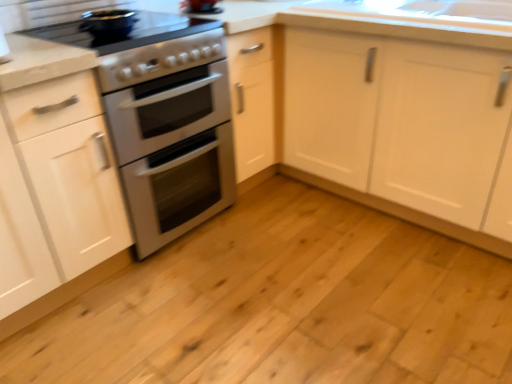
Question: Does white matte cabinet at left, placed as the 1th cabinetry when sorted from left to right, have a smaller size compared to matte black pot at upper left, which is counted as the 2th appliance, starting from the bottom?

Choices:
 (A) no
 (B) yes

Answer: (A)

Question: Is white matte cabinet at left, acting as the second cabinetry starting from the right, shorter than matte black pot at upper left, which is counted as the 2th appliance, starting from the bottom?

Choices:
 (A) no
 (B) yes

Answer: (A)

Question: Considering the relative positions of white matte cabinet at left, acting as the second cabinetry starting from the right, and matte black pot at upper left, which is counted as the 2th appliance, starting from the bottom, in the image provided, is white matte cabinet at left, acting as the second cabinetry starting from the right, to the right of matte black pot at upper left, which is counted as the 2th appliance, starting from the bottom, from the viewer's perspective?

Choices:
 (A) no
 (B) yes

Answer: (A)

Question: Is white matte cabinet at left, placed as the 1th cabinetry when sorted from left to right, completely or partially outside of matte black pot at upper left, marked as the 1th appliance in a top-to-bottom arrangement?

Choices:
 (A) no
 (B) yes

Answer: (B)

Question: From a real-world perspective, is white matte cabinet at left, acting as the second cabinetry starting from the right, on matte black pot at upper left, which is counted as the 2th appliance, starting from the bottom?

Choices:
 (A) yes
 (B) no

Answer: (B)

Question: Considering their positions, is natural wood floor at center located in front of or behind white matte cabinet at left, acting as the second cabinetry starting from the right?

Choices:
 (A) front
 (B) behind

Answer: (A)

Question: Would you say natural wood floor at center is to the left or to the right of white matte cabinet at left, acting as the second cabinetry starting from the right, in the picture?

Choices:
 (A) right
 (B) left

Answer: (A)

Question: Looking at the image, does natural wood floor at center seem bigger or smaller compared to white matte cabinet at left, placed as the 1th cabinetry when sorted from left to right?

Choices:
 (A) small
 (B) big

Answer: (A)

Question: From their relative heights in the image, would you say natural wood floor at center is taller or shorter than white matte cabinet at left, placed as the 1th cabinetry when sorted from left to right?

Choices:
 (A) short
 (B) tall

Answer: (A)

Question: Is point (212, 137) positioned closer to the camera than point (410, 182)?

Choices:
 (A) farther
 (B) closer

Answer: (A)

Question: From the image's perspective, relative to white matte cabinet at center, which is the second cabinetry from left to right, is satin silver oven at center, which appears as the first appliance when ordered from the bottom, above or below?

Choices:
 (A) below
 (B) above

Answer: (A)

Question: Considering the positions of satin silver oven at center, which is the 2th appliance in top-to-bottom order, and white matte cabinet at center, which is the second cabinetry from left to right, in the image, is satin silver oven at center, which is the 2th appliance in top-to-bottom order, taller or shorter than white matte cabinet at center, which is the second cabinetry from left to right,?

Choices:
 (A) tall
 (B) short

Answer: (A)

Question: From a real-world perspective, is satin silver oven at center, which is the 2th appliance in top-to-bottom order, positioned above or below white matte cabinet at center, the 1th cabinetry from the right?

Choices:
 (A) below
 (B) above

Answer: (B)

Question: Is point (92, 299) closer or farther from the camera than point (335, 74)?

Choices:
 (A) farther
 (B) closer

Answer: (B)

Question: From the image's perspective, relative to white matte cabinet at center, which is the second cabinetry from left to right, is natural wood floor at center above or below?

Choices:
 (A) above
 (B) below

Answer: (B)